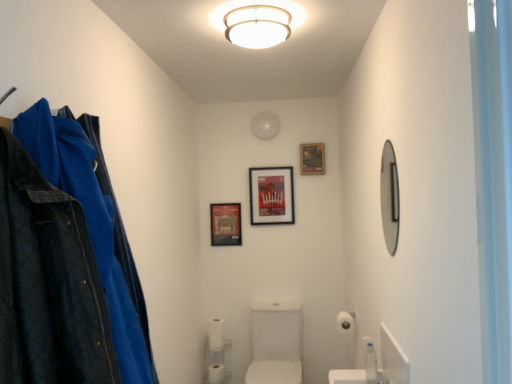
What do you see at coordinates (312, 159) in the screenshot?
I see `matte black picture frame at upper center, arranged as the 1th picture frame when viewed from the right` at bounding box center [312, 159].

You are a GUI agent. You are given a task and a screenshot of the screen. Output one action in this format:
    pyautogui.click(x=<x>, y=<y>)
    Task: Click on the matte black picture frame at upper center, arranged as the 1th picture frame when viewed from the right
    
    Given the screenshot: What is the action you would take?
    pyautogui.click(x=312, y=159)

What is the approximate height of white matte toilet paper at lower right, arranged as the first toilet paper when viewed from the right?

It is 4.37 inches.

Find the location of a particular element. This screenshot has height=384, width=512. matte plastic picture frame at center, arranged as the 2th picture frame when viewed from the right is located at coordinates (271, 195).

The width and height of the screenshot is (512, 384). What do you see at coordinates (216, 373) in the screenshot?
I see `white matte toilet paper at lower center, which appears as the 1th toilet paper when ordered from the bottom` at bounding box center [216, 373].

Locate an element on the screen. This screenshot has width=512, height=384. matte black picture frame at upper center, arranged as the 1th picture frame when viewed from the right is located at coordinates (312, 159).

The image size is (512, 384). What are the coordinates of `sink directly beneath the white matte ceiling light at upper center (from a real-world perspective)` in the screenshot? It's located at (275, 343).

From the image's perspective, would you say white glossy sink at center is positioned over white matte ceiling light at upper center?

No, from the image's perspective, white glossy sink at center is not on top of white matte ceiling light at upper center.

Based on their positions, is white glossy sink at center located to the left or right of white matte ceiling light at upper center?

white glossy sink at center is positioned on white matte ceiling light at upper center's right side.

Consider the image. Considering the positions of objects white glossy sink at center and white matte ceiling light at upper center in the image provided, who is in front, white glossy sink at center or white matte ceiling light at upper center?

Positioned in front is white matte ceiling light at upper center.

Considering the sizes of objects white plastic shelf at lower center and white matte ceiling light at upper center in the image provided, who is smaller, white plastic shelf at lower center or white matte ceiling light at upper center?

white matte ceiling light at upper center.

From a real-world perspective, is white plastic shelf at lower center below white matte ceiling light at upper center?

Correct, in the physical world, white plastic shelf at lower center is lower than white matte ceiling light at upper center.

Is white plastic shelf at lower center facing away from white matte ceiling light at upper center?

No, white plastic shelf at lower center's orientation is not away from white matte ceiling light at upper center.

Consider the image. Is white plastic shelf at lower center spatially inside white matte ceiling light at upper center, or outside of it?

white plastic shelf at lower center is outside white matte ceiling light at upper center.

Does silver metallic mirror at right lie in front of clear plastic bottle at lower right?

Yes, it is in front of clear plastic bottle at lower right.

Can you confirm if silver metallic mirror at right is positioned to the right of clear plastic bottle at lower right?

Indeed, silver metallic mirror at right is positioned on the right side of clear plastic bottle at lower right.

Which is nearer, (396, 229) or (369, 356)?

Point (396, 229) is closer to the camera than point (369, 356).

Where is `mirror in front of the clear plastic bottle at lower right`? The width and height of the screenshot is (512, 384). mirror in front of the clear plastic bottle at lower right is located at coordinates (389, 197).

Consider the image. Between metallic poster at center, acting as the third picture frame starting from the right, and matte black picture frame at upper center, placed as the third picture frame when sorted from left to right, which one is positioned in front?

matte black picture frame at upper center, placed as the third picture frame when sorted from left to right, is closer to the camera.

From the picture: Which of these two, metallic poster at center, marked as the 1th picture frame in a left-to-right arrangement, or matte black picture frame at upper center, arranged as the 1th picture frame when viewed from the right, is smaller?

Smaller between the two is matte black picture frame at upper center, arranged as the 1th picture frame when viewed from the right.

Is metallic poster at center, marked as the 1th picture frame in a left-to-right arrangement, wider or thinner than matte black picture frame at upper center, placed as the third picture frame when sorted from left to right?

metallic poster at center, marked as the 1th picture frame in a left-to-right arrangement, is thinner than matte black picture frame at upper center, placed as the third picture frame when sorted from left to right.

Would you consider metallic poster at center, acting as the third picture frame starting from the right, to be distant from matte black picture frame at upper center, placed as the third picture frame when sorted from left to right?

That's not correct — metallic poster at center, acting as the third picture frame starting from the right, is a little close to matte black picture frame at upper center, placed as the third picture frame when sorted from left to right.

Where is `fixture on the right of metallic poster at center, acting as the third picture frame starting from the right`? The image size is (512, 384). fixture on the right of metallic poster at center, acting as the third picture frame starting from the right is located at coordinates (257, 26).

From the image's perspective, relative to white matte ceiling light at upper center, is metallic poster at center, acting as the third picture frame starting from the right, above or below?

metallic poster at center, acting as the third picture frame starting from the right, is below white matte ceiling light at upper center.

Based on their sizes in the image, would you say metallic poster at center, acting as the third picture frame starting from the right, is bigger or smaller than white matte ceiling light at upper center?

metallic poster at center, acting as the third picture frame starting from the right, is smaller than white matte ceiling light at upper center.

From the image's perspective, is matte plastic picture frame at center, marked as the 2th picture frame in a left-to-right arrangement, located above or below silver metallic mirror at right?

matte plastic picture frame at center, marked as the 2th picture frame in a left-to-right arrangement, is situated lower than silver metallic mirror at right in the image.

In the scene shown: Could you tell me if matte plastic picture frame at center, marked as the 2th picture frame in a left-to-right arrangement, is facing silver metallic mirror at right?

Yes, matte plastic picture frame at center, marked as the 2th picture frame in a left-to-right arrangement, is aimed at silver metallic mirror at right.

Relative to silver metallic mirror at right, is matte plastic picture frame at center, marked as the 2th picture frame in a left-to-right arrangement, in front or behind?

matte plastic picture frame at center, marked as the 2th picture frame in a left-to-right arrangement, is positioned farther from the viewer than silver metallic mirror at right.

Considering the relative sizes of matte plastic picture frame at center, marked as the 2th picture frame in a left-to-right arrangement, and silver metallic mirror at right in the image provided, is matte plastic picture frame at center, marked as the 2th picture frame in a left-to-right arrangement, shorter than silver metallic mirror at right?

Yes, matte plastic picture frame at center, marked as the 2th picture frame in a left-to-right arrangement, is shorter than silver metallic mirror at right.

Considering the sizes of matte black picture frame at upper center, arranged as the 1th picture frame when viewed from the right, and clear plastic bottle at lower right in the image, is matte black picture frame at upper center, arranged as the 1th picture frame when viewed from the right, wider or thinner than clear plastic bottle at lower right?

matte black picture frame at upper center, arranged as the 1th picture frame when viewed from the right, is thinner than clear plastic bottle at lower right.

Is there a large distance between matte black picture frame at upper center, placed as the third picture frame when sorted from left to right, and clear plastic bottle at lower right?

matte black picture frame at upper center, placed as the third picture frame when sorted from left to right, is far away from clear plastic bottle at lower right.

Identify the location of toiletry in front of the matte black picture frame at upper center, placed as the third picture frame when sorted from left to right. (370, 363).

Considering the points (315, 149) and (366, 343), which point is in front, point (315, 149) or point (366, 343)?

The point (366, 343) is closer.

What are the coordinates of `fixture above the white glossy sink at center (from a real-world perspective)` in the screenshot? It's located at (257, 26).

In order to click on fixture located on the right of white plastic shelf at lower center in this screenshot , I will do `click(257, 26)`.

Estimate the real-world distances between objects in this image. Which object is closer to white matte toilet paper at lower right, acting as the 1th toilet paper starting from the front, white matte ceiling light at upper center or metallic poster at center, acting as the third picture frame starting from the right?

metallic poster at center, acting as the third picture frame starting from the right, lies closer to white matte toilet paper at lower right, acting as the 1th toilet paper starting from the front, than the other object.

Which object lies nearer to the anchor point white plastic shelf at lower center, clear plastic bottle at lower right or white matte toilet paper at lower right, which appears as the third toilet paper when viewed from the back?

white matte toilet paper at lower right, which appears as the third toilet paper when viewed from the back, lies closer to white plastic shelf at lower center than the other object.

Looking at the image, which one is located closer to matte plastic picture frame at center, arranged as the 2th picture frame when viewed from the right, metallic poster at center, marked as the 1th picture frame in a left-to-right arrangement, or clear plastic bottle at lower right?

metallic poster at center, marked as the 1th picture frame in a left-to-right arrangement, lies closer to matte plastic picture frame at center, arranged as the 2th picture frame when viewed from the right, than the other object.

Estimate the real-world distances between objects in this image. Which object is further from metallic poster at center, acting as the third picture frame starting from the right, clear plastic bottle at lower right or white matte toilet paper at lower center, the second toilet paper viewed from the back?

clear plastic bottle at lower right.

Which object lies further to the anchor point white matte ceiling light at upper center, matte plastic picture frame at center, arranged as the 2th picture frame when viewed from the right, or matte black picture frame at upper center, placed as the third picture frame when sorted from left to right?

matte plastic picture frame at center, arranged as the 2th picture frame when viewed from the right, is further to white matte ceiling light at upper center.

From the image, which object appears to be farther from clear plastic bottle at lower right, silver metallic mirror at right or white matte toilet paper at lower center, which appears as the 1th toilet paper when ordered from the bottom?

Based on the image, white matte toilet paper at lower center, which appears as the 1th toilet paper when ordered from the bottom, appears to be further to clear plastic bottle at lower right.

Which object lies nearer to the anchor point matte black picture frame at upper center, placed as the third picture frame when sorted from left to right, matte plastic picture frame at center, marked as the 2th picture frame in a left-to-right arrangement, or clear plastic bottle at lower right?

Among the two, matte plastic picture frame at center, marked as the 2th picture frame in a left-to-right arrangement, is located nearer to matte black picture frame at upper center, placed as the third picture frame when sorted from left to right.

Looking at the image, which one is located further to white plastic shelf at lower center, clear plastic bottle at lower right or silver metallic mirror at right?

Based on the image, silver metallic mirror at right appears to be further to white plastic shelf at lower center.

Locate an element on the screen. toiletry between silver metallic mirror at right and white matte toilet paper at lower center, the second toilet paper viewed from the back, from front to back is located at coordinates (370, 363).

Image resolution: width=512 pixels, height=384 pixels. I want to click on fixture between silver metallic mirror at right and matte black picture frame at upper center, placed as the third picture frame when sorted from left to right, in the front-back direction, so click(x=257, y=26).

Locate an element on the screen. Image resolution: width=512 pixels, height=384 pixels. picture frame between matte plastic picture frame at center, marked as the 2th picture frame in a left-to-right arrangement, and white glossy sink at center in the up-down direction is located at coordinates (225, 224).

Find the location of a particular element. toiletry between white matte ceiling light at upper center and matte plastic picture frame at center, arranged as the 2th picture frame when viewed from the right, along the z-axis is located at coordinates point(370,363).